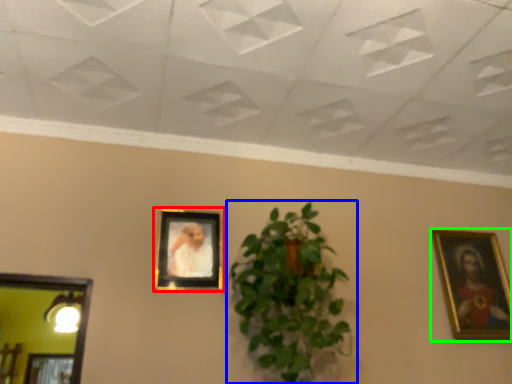
Question: Estimate the real-world distances between objects in this image. Which object is farther from picture frame (highlighted by a red box), houseplant (highlighted by a blue box) or picture frame (highlighted by a green box)?

Choices:
 (A) houseplant
 (B) picture frame

Answer: (B)